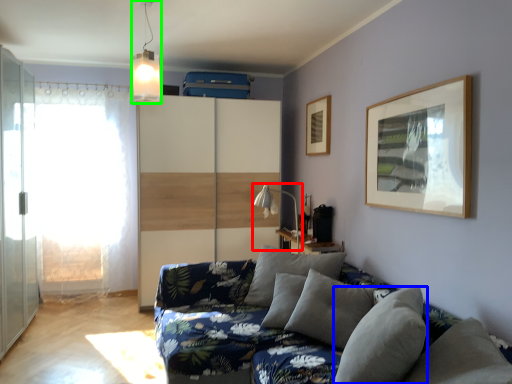
Question: Which is nearer to the table lamp (highlighted by a red box)? pillow (highlighted by a blue box) or light fixture (highlighted by a green box).

Choices:
 (A) pillow
 (B) light fixture

Answer: (B)